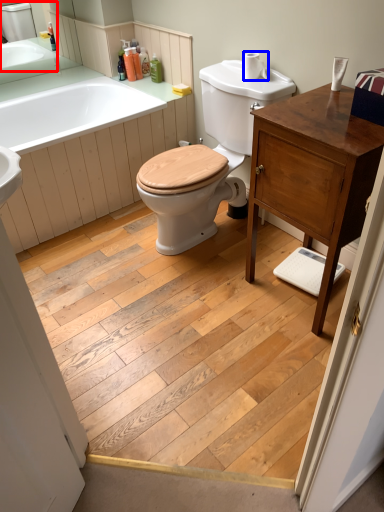
Question: Which point is closer to the camera, sink (highlighted by a red box) or toilet paper (highlighted by a blue box)?

Choices:
 (A) sink
 (B) toilet paper

Answer: (B)